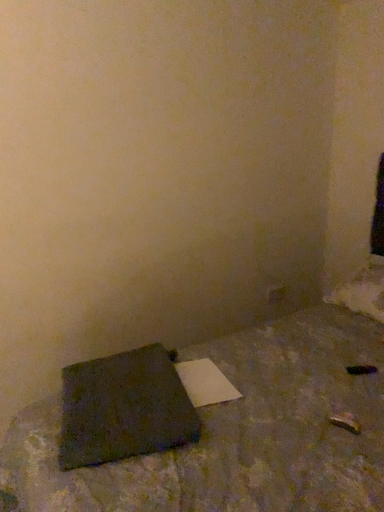
Question: Does dark gray fabric notebook at lower left have a greater width compared to dark gray fabric cushion at lower left?

Choices:
 (A) no
 (B) yes

Answer: (A)

Question: Is dark gray fabric notebook at lower left further to the viewer compared to dark gray fabric cushion at lower left?

Choices:
 (A) yes
 (B) no

Answer: (A)

Question: Can you confirm if dark gray fabric notebook at lower left is shorter than dark gray fabric cushion at lower left?

Choices:
 (A) no
 (B) yes

Answer: (B)

Question: From a real-world perspective, is dark gray fabric notebook at lower left positioned under dark gray fabric cushion at lower left based on gravity?

Choices:
 (A) yes
 (B) no

Answer: (A)

Question: Is dark gray fabric notebook at lower left to the left of dark gray fabric cushion at lower left from the viewer's perspective?

Choices:
 (A) no
 (B) yes

Answer: (B)

Question: Is dark gray fabric notebook at lower left in front of dark gray fabric cushion at lower left?

Choices:
 (A) no
 (B) yes

Answer: (A)

Question: From a real-world perspective, is dark gray fabric cushion at lower left located higher than dark gray fabric notebook at lower left?

Choices:
 (A) no
 (B) yes

Answer: (B)

Question: Are dark gray fabric cushion at lower left and dark gray fabric notebook at lower left beside each other?

Choices:
 (A) no
 (B) yes

Answer: (A)

Question: Is dark gray fabric cushion at lower left at the right side of dark gray fabric notebook at lower left?

Choices:
 (A) yes
 (B) no

Answer: (A)

Question: Does dark gray fabric cushion at lower left appear on the left side of dark gray fabric notebook at lower left?

Choices:
 (A) yes
 (B) no

Answer: (B)

Question: From the image's perspective, is dark gray fabric cushion at lower left under dark gray fabric notebook at lower left?

Choices:
 (A) yes
 (B) no

Answer: (B)

Question: From a real-world perspective, is dark gray fabric cushion at lower left located beneath dark gray fabric notebook at lower left?

Choices:
 (A) no
 (B) yes

Answer: (A)

Question: Is dark gray fabric notebook at lower left to the left or to the right of dark gray fabric cushion at lower left in the image?

Choices:
 (A) left
 (B) right

Answer: (A)